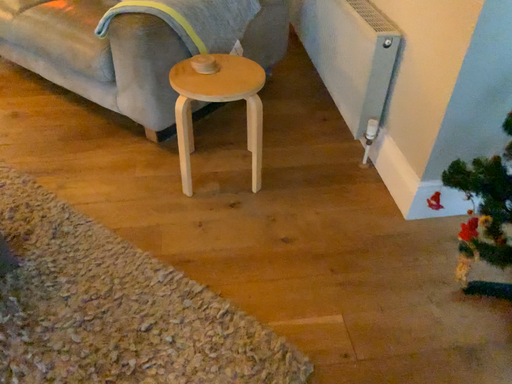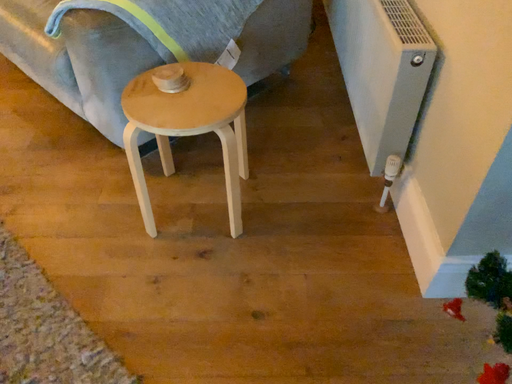
Question: How did the camera likely rotate when shooting the video?

Choices:
 (A) rotated right
 (B) rotated left

Answer: (B)